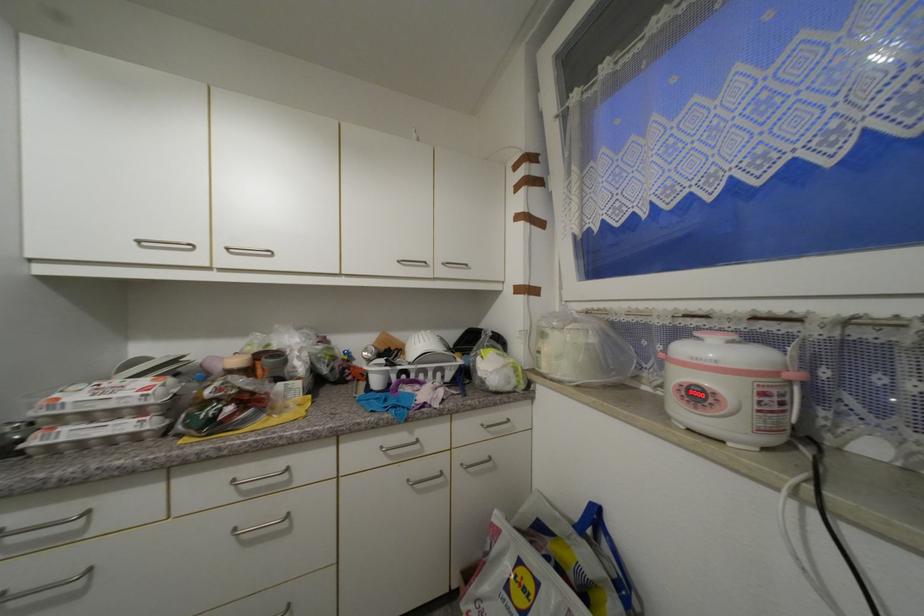
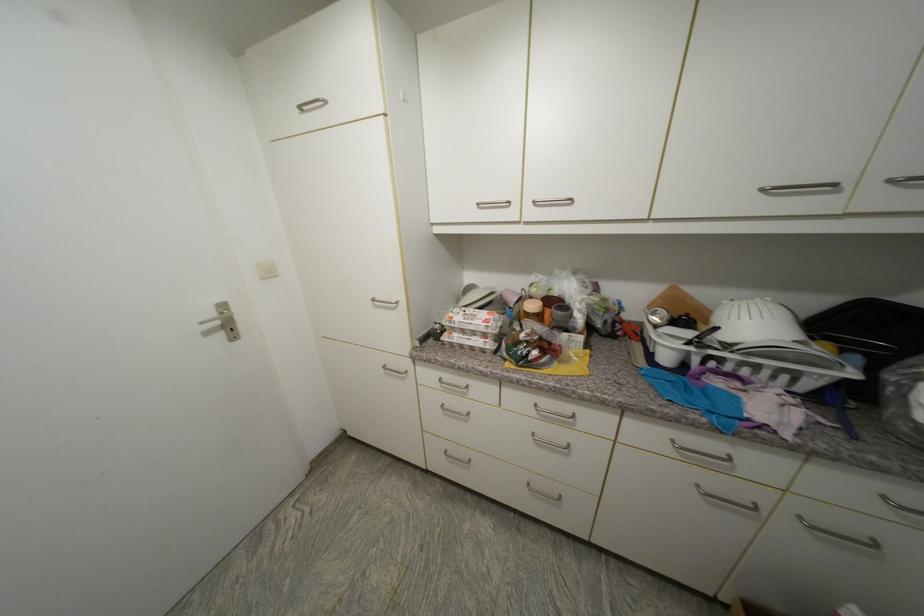
Where in the second image is the point corresponding to the point at 405,262 from the first image?

(768, 191)